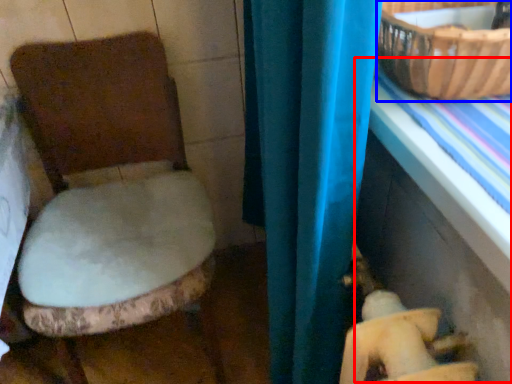
Question: Among these objects, which one is farthest to the camera, table (highlighted by a red box) or basket (highlighted by a blue box)?

Choices:
 (A) table
 (B) basket

Answer: (B)